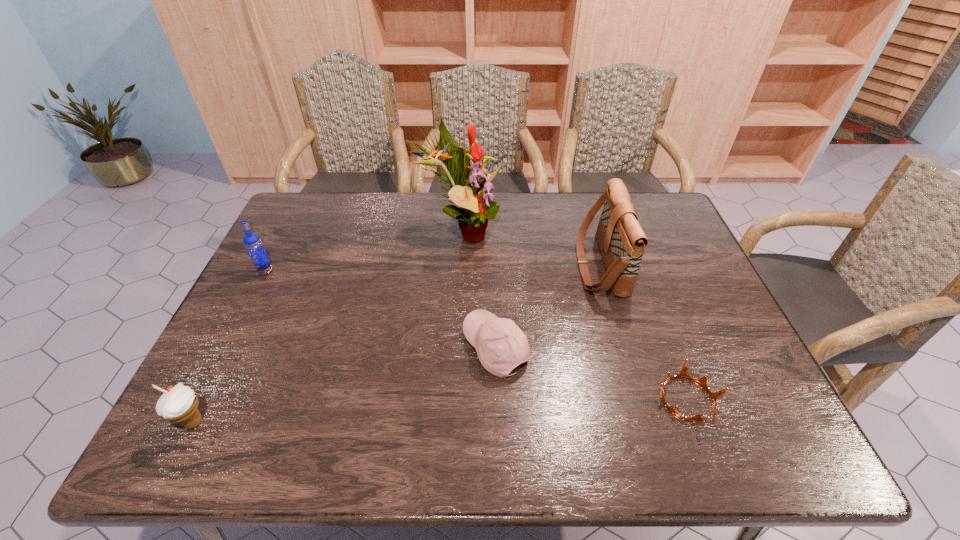
Where is `the fifth closest object to the shortest object`? The width and height of the screenshot is (960, 540). the fifth closest object to the shortest object is located at coordinates (252, 242).

I want to click on vacant space that satisfies the following two spatial constraints: 1. on the front-facing side of the crown; 2. on the right side of the tallest object, so click(x=453, y=400).

I want to click on free space that satisfies the following two spatial constraints: 1. on the back side of the crown; 2. on the left side of the icecream, so (x=205, y=400).

Identify the location of free space that satisfies the following two spatial constraints: 1. on the front-facing side of the crown; 2. on the left side of the baseball cap. (497, 400).

I want to click on free spot that satisfies the following two spatial constraints: 1. on the front-facing side of the shortest object; 2. on the left side of the baseball cap, so click(497, 400).

Where is `vacant region that satisfies the following two spatial constraints: 1. on the front-facing side of the crown; 2. on the right side of the baseball cap`? The image size is (960, 540). vacant region that satisfies the following two spatial constraints: 1. on the front-facing side of the crown; 2. on the right side of the baseball cap is located at coordinates (497, 400).